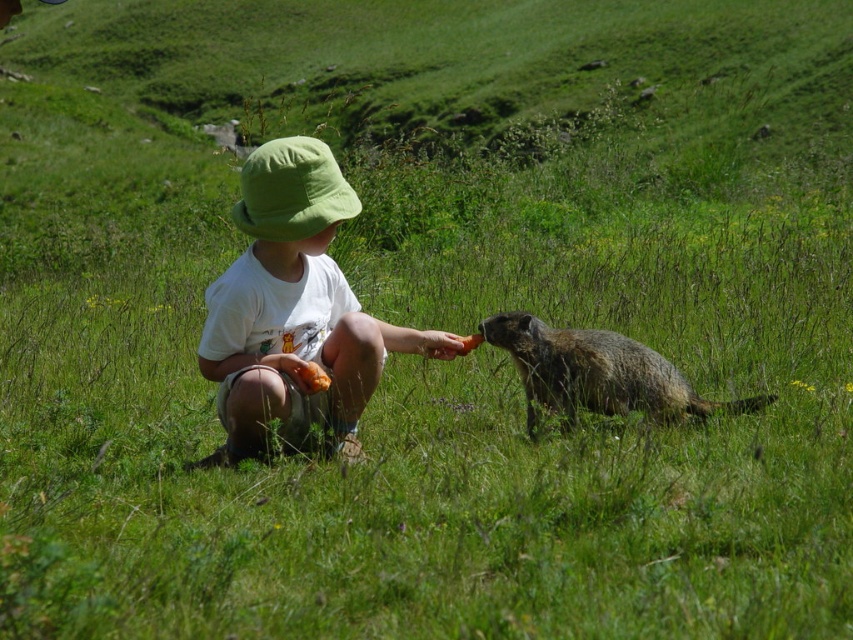
You are a photographer trying to capture a closeup of the brown furry groundhog at lower right and the green fabric hat at center. Which object is wider in the image?

The brown furry groundhog at lower right is wider than the green fabric hat at center.

You are a photographer aiming to capture the interaction between the brown furry groundhog at lower right and the green fabric hat at center. Based on their positions, which object is closer to the camera?

The brown furry groundhog at lower right is positioned under the green fabric hat at center, so the groundhog is closer to the camera than the hat.